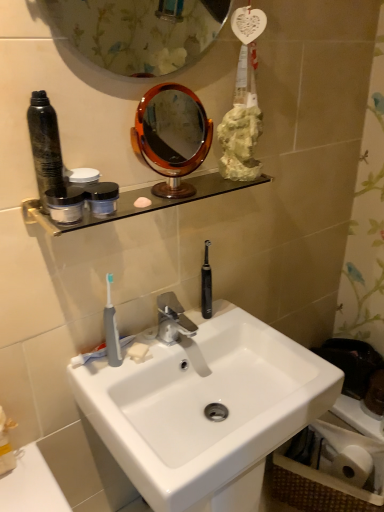
The height and width of the screenshot is (512, 384). I want to click on free spot to the right of black rubber toothbrush at center, acting as the first toothbrush starting from the back, so click(x=254, y=325).